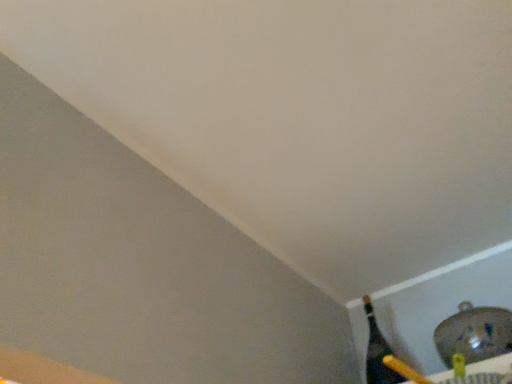
What do you see at coordinates (378, 351) in the screenshot? I see `green glass bottle at bottom right` at bounding box center [378, 351].

Image resolution: width=512 pixels, height=384 pixels. In order to click on green glass bottle at bottom right in this screenshot , I will do [378, 351].

Locate an element on the screen. This screenshot has width=512, height=384. green glass bottle at bottom right is located at coordinates click(x=378, y=351).